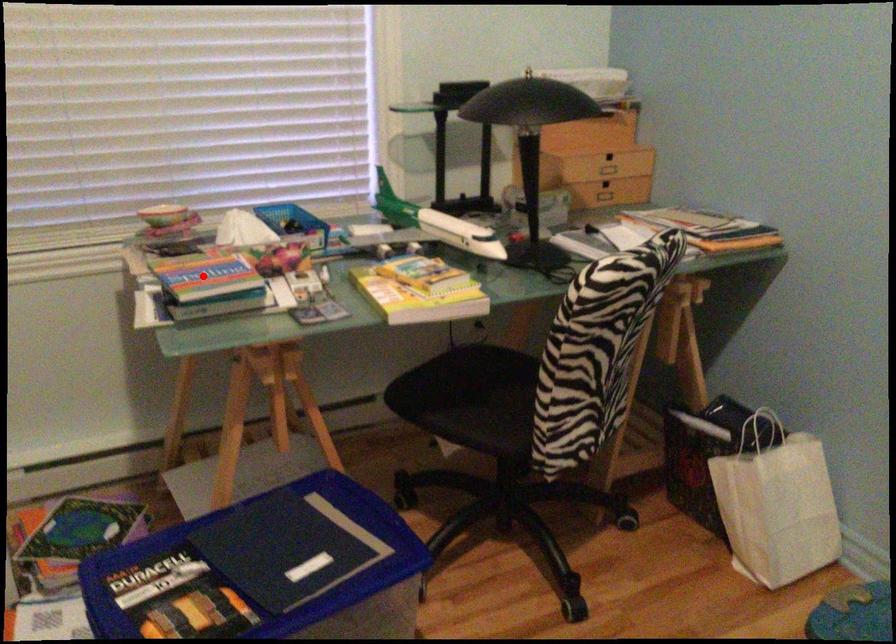
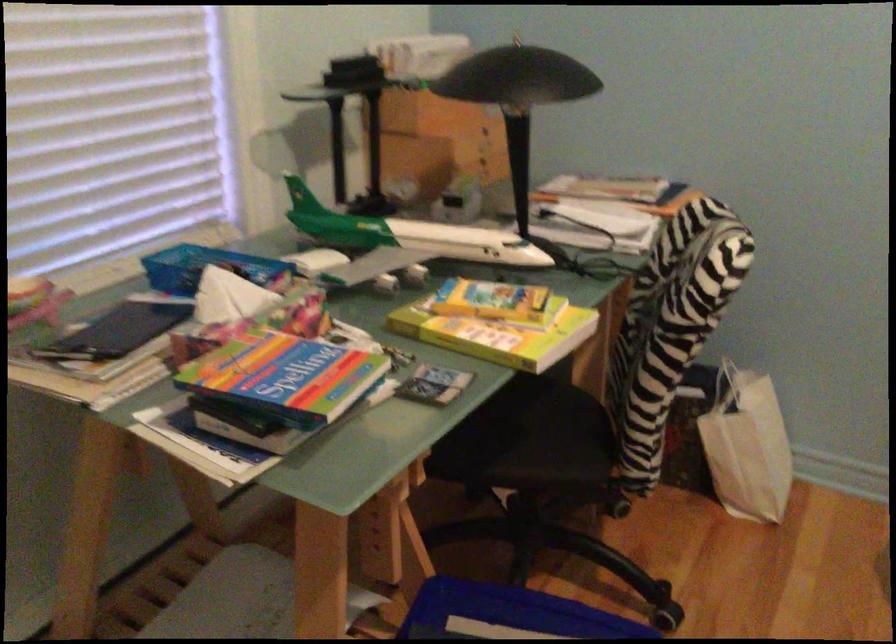
Where in the second image is the point corresponding to the highlighted location from the first image?

(285, 377)